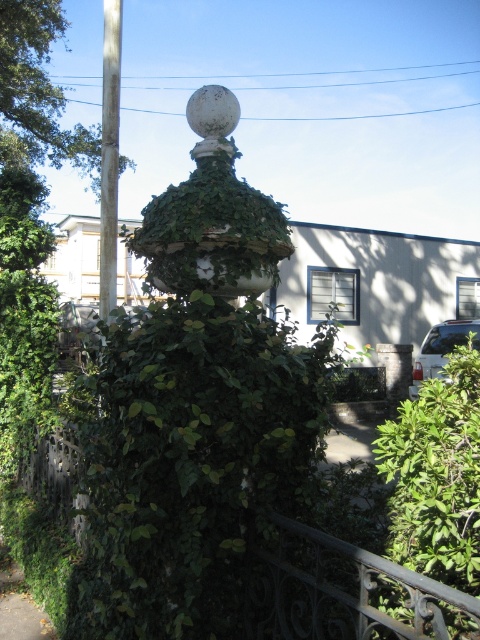
You are a GUI agent. You are given a task and a screenshot of the screen. Output one action in this format:
    pyautogui.click(x=<x>, y=<y>)
    Task: Click on the green ivy-covered fence at center
    Image resolution: width=480 pixels, height=640 pixels.
    Given the screenshot: What is the action you would take?
    pyautogui.click(x=346, y=593)

In the scene shown: Does green ivy-covered fence at center have a lesser height compared to brown wooden pole at left?

Yes.

Who is more distant from viewer, (280,618) or (117,90)?

The point (117,90) is behind.

Identify the location of green ivy-covered fence at center. This screenshot has height=640, width=480. (346, 593).

Which is more to the right, green ivy-covered fence at center or brown wood tree at upper left?

green ivy-covered fence at center is more to the right.

Between point (44, 468) and point (78, 154), which one is positioned in front?

Positioned in front is point (44, 468).

This screenshot has width=480, height=640. Find the location of `green ivy-covered fence at center`. green ivy-covered fence at center is located at coordinates (346, 593).

Is green ivy-covered fence at center behind green leafy bush at lower right?

No, green ivy-covered fence at center is in front of green leafy bush at lower right.

Can you confirm if green ivy-covered fence at center is positioned below green leafy bush at lower right?

Yes.

Who is more distant from viewer, [363,561] or [443,516]?

Point [363,561]

Where is `green ivy-covered fence at center`? green ivy-covered fence at center is located at coordinates (346, 593).